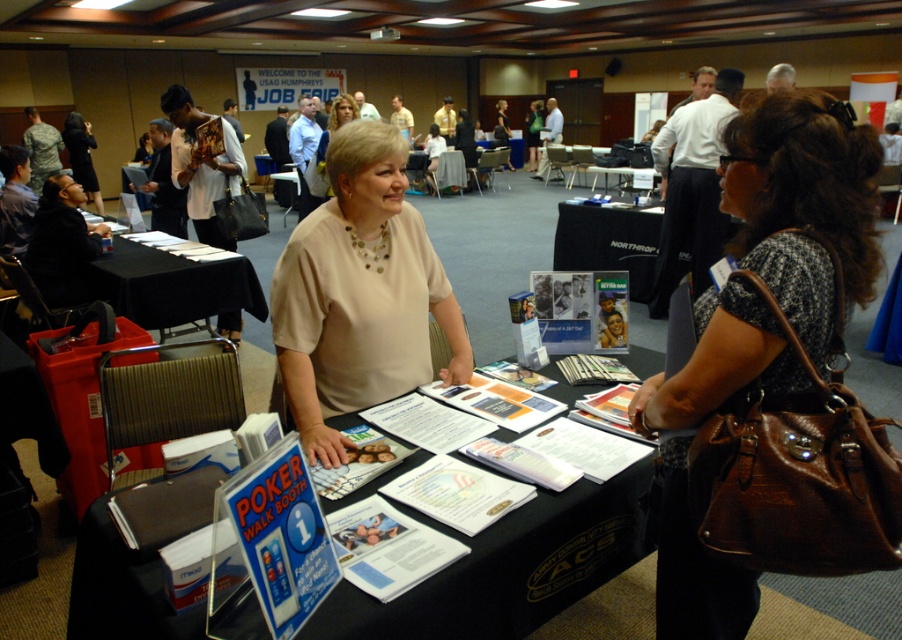
You are organizing a job fair and need to place a large banner on the table. Which table, the black fabric table at center or the black plastic table at center, can accommodate the banner without it hanging over the edges?

The black plastic table at center has a larger size compared to the black fabric table at center, so the large banner can be placed on the black plastic table at center without it hanging over the edges.

You are organizing a job fair and need to ensure that all materials are properly displayed. Given the scene described, can the matte beige blouse at center be placed on the black paper at left without overlapping the edges?

The black paper at left is wider than the matte beige blouse at center, so yes, the matte beige blouse at center can be placed on the black paper at left without overlapping the edges.